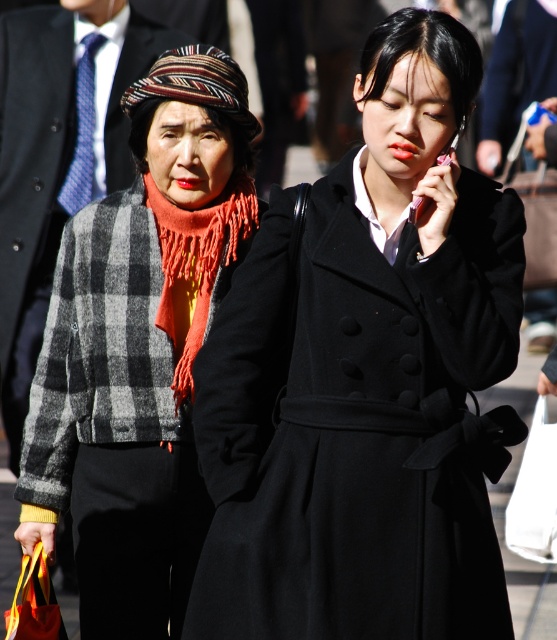
Can you confirm if matte black coat at center is smaller than white fabric bag at lower right?

No, matte black coat at center is not smaller than white fabric bag at lower right.

Is matte black coat at center wider than white fabric bag at lower right?

Yes.

Is point (206, 460) farther from camera compared to point (534, 552)?

No, (206, 460) is closer to viewer.

Identify the location of matte black coat at center. The height and width of the screenshot is (640, 557). (367, 380).

Can you confirm if matte black coat at center is positioned above orange fringed scarf at center?

No, matte black coat at center is not above orange fringed scarf at center.

Does matte black coat at center have a lesser height compared to orange fringed scarf at center?

In fact, matte black coat at center may be taller than orange fringed scarf at center.

Which is behind, point (216, 454) or point (174, 209)?

Point (174, 209)

Locate an element on the screen. matte black coat at center is located at coordinates (367, 380).

Does plaid woolen jacket at left have a lesser height compared to orange fringed scarf at center?

No, plaid woolen jacket at left is not shorter than orange fringed scarf at center.

Can you confirm if plaid woolen jacket at left is positioned to the left of orange fringed scarf at center?

Yes, plaid woolen jacket at left is to the left of orange fringed scarf at center.

Measure the distance between plaid woolen jacket at left and camera.

A distance of 22.71 feet exists between plaid woolen jacket at left and camera.

Image resolution: width=557 pixels, height=640 pixels. I want to click on plaid woolen jacket at left, so click(139, 348).